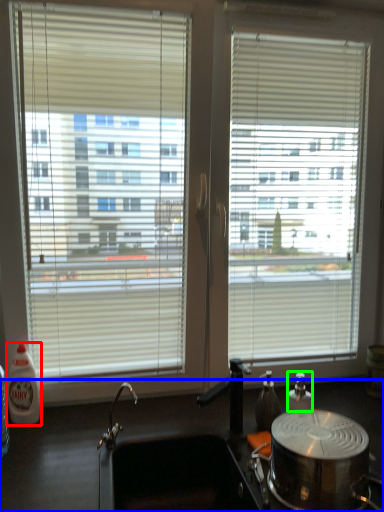
Question: Which is farther away from bottle (highlighted by a red box)? counter top (highlighted by a blue box) or bottle (highlighted by a green box)?

Choices:
 (A) counter top
 (B) bottle

Answer: (B)